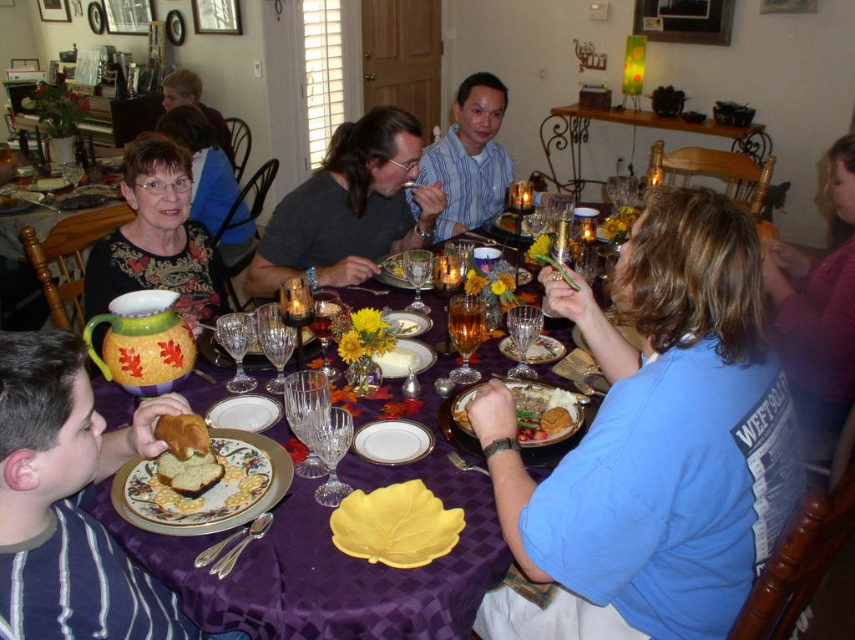
You are sitting at the dining table and want to pass the white porcelain plate at center to the person wearing the matte blue shirt at upper left. Which direction should you pass it to reach them?

You should pass the white porcelain plate at center to the left, as it is currently to the right of the matte blue shirt at upper left.

You are a guest at this dinner and need to find your seat. You see the striped fabric shirt at lower left and the matte blue shirt at upper left. Which shirt is closer to the table?

The striped fabric shirt at lower left is closer to the table because it is positioned below the matte blue shirt at upper left, which is higher up.